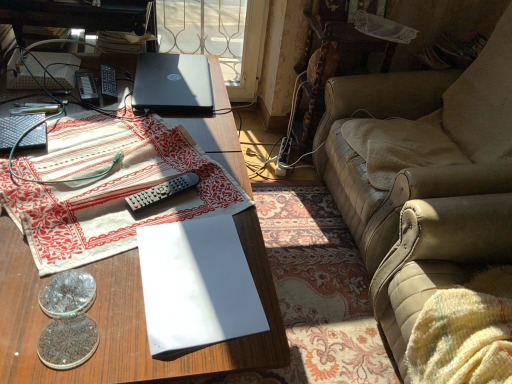
This screenshot has height=384, width=512. I want to click on vacant space in between black plastic remote control at upper left, the 3th remote control from the right, and shiny metallic coin at lower left, placed as the second coin when sorted from front to back, so click(x=76, y=172).